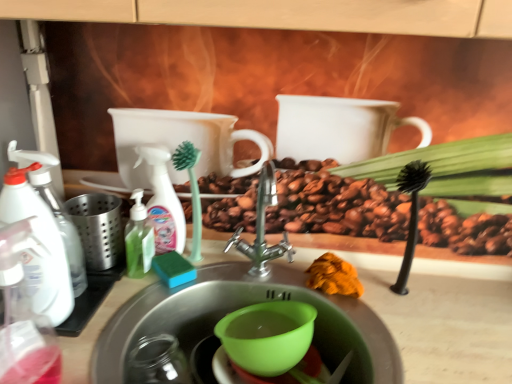
At what (x,y) coordinates should I click in order to perform the action: click on free space that is to the left of orange fabric at sink. Please return your answer as a coordinate pair (x, y). Looking at the image, I should click on (260, 275).